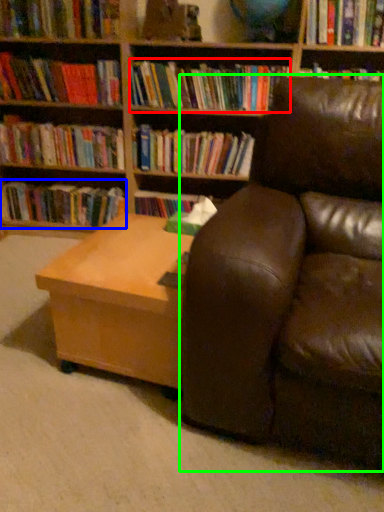
Question: Estimate the real-world distances between objects in this image. Which object is closer to book (highlighted by a red box), book (highlighted by a blue box) or studio couch (highlighted by a green box)?

Choices:
 (A) book
 (B) studio couch

Answer: (A)